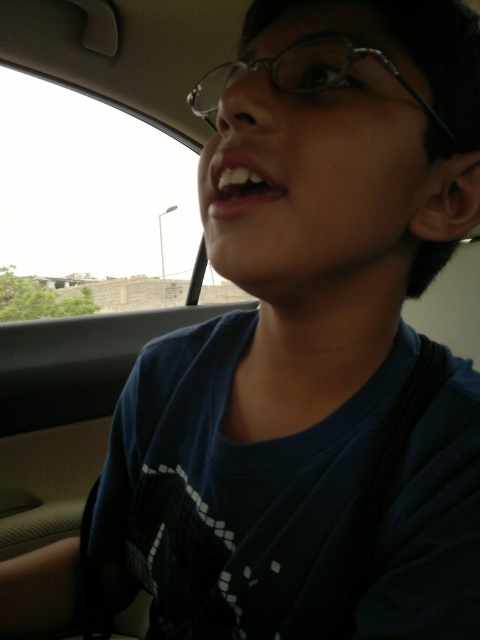
You are a photographer trying to capture the clear plastic glasses at upper center inside the car. The camera you are using has a focal point at coordinate point 0.122, 0.660. Will the glasses be in focus?

The clear plastic glasses at upper center is located at point [316,77], so yes, the glasses will be in focus as the camera focal point matches its location.

The person in the car is wearing clear plastic glasses at upper center and has white glossy teeth at upper center. Which object is taller?

The clear plastic glasses at upper center is taller than the white glossy teeth at upper center.

You are sitting in the passenger seat of a car and want to reach a point located at coordinates point (440, 116). If your hand can extend 14 inches forward, can you reach it?

The point (440, 116) is 15.18 inches away from the viewer, which is slightly beyond the 14 inches your hand can extend. Therefore, you cannot reach it.